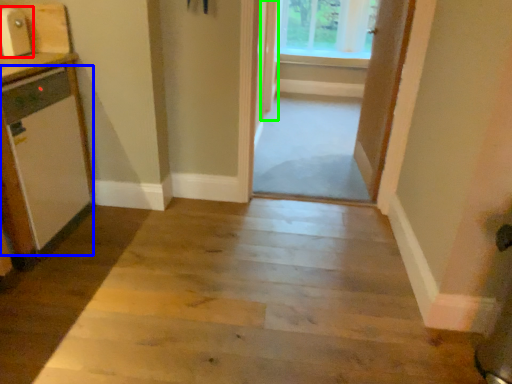
Question: Considering the real-world distances, which object is closest to appliance (highlighted by a red box)? appliance (highlighted by a blue box) or door (highlighted by a green box).

Choices:
 (A) appliance
 (B) door

Answer: (A)